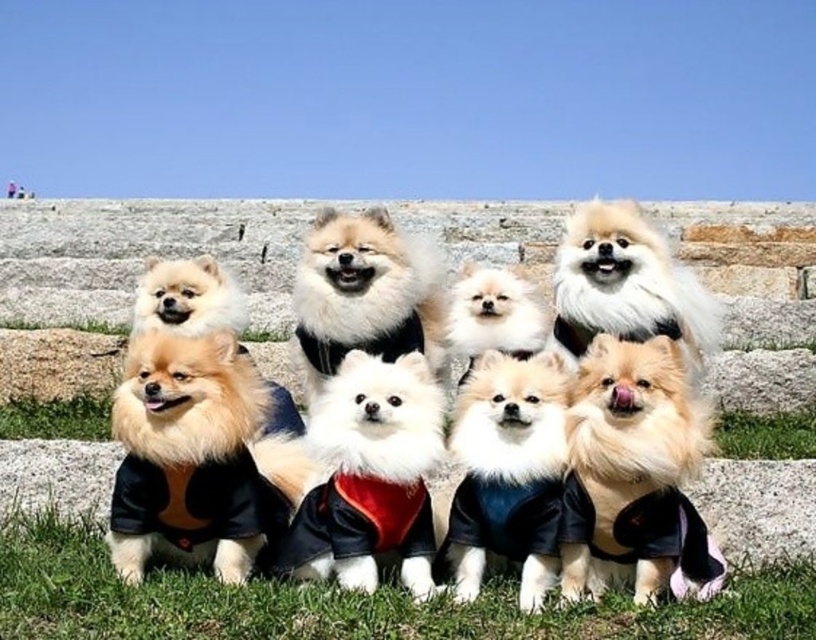
You are a photographer setting up for a group photo of the fluffy white dog at center and the green grass at lower center. You need to ensure both subjects are in focus. Which subject requires a wider lens aperture to capture properly?

The fluffy white dog at center requires a wider lens aperture because it is larger in width compared to the green grass at lower center, necessitating a greater depth of field adjustment.

You are a photographer setting up for a dog photoshoot. You want to ensure the white fluffy dog at center is framed properly. Given the green grass at lower center, which object occupies more horizontal space in the image?

The green grass at lower center occupies more horizontal space than the white fluffy dog at center because its width is larger.

You are a photographer trying to capture a clear image of the fluffy white dog at center and the fluffy white fur at center. Which one should you focus on if you want to ensure the subject is in sharp focus due to its size?

The fluffy white dog at center should be focused on because it has a larger size compared to the fluffy white fur at center, making it easier to capture in sharp focus.